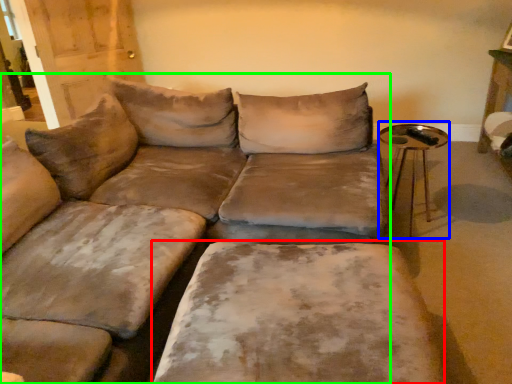
Question: Which object is positioned farthest from wide (highlighted by a red box)? Select from side table (highlighted by a blue box) and studio couch (highlighted by a green box).

Choices:
 (A) side table
 (B) studio couch

Answer: (A)